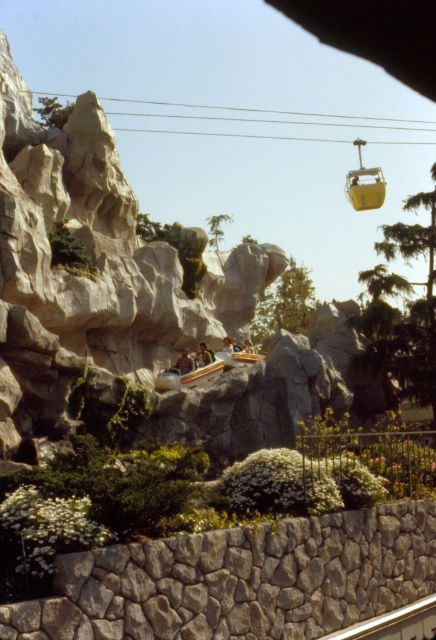
Looking at this image, between orange glossy roller coaster at center and yellow matte ski lift at upper right, which one is positioned higher?

yellow matte ski lift at upper right is above.

Can you confirm if orange glossy roller coaster at center is positioned above yellow matte ski lift at upper right?

No.

Where is `orange glossy roller coaster at center`? This screenshot has width=436, height=640. orange glossy roller coaster at center is located at coordinates (207, 365).

Is yellow matte ski lift at upper right wider than brown leather jacket at center?

Correct, the width of yellow matte ski lift at upper right exceeds that of brown leather jacket at center.

This screenshot has width=436, height=640. What do you see at coordinates (364, 182) in the screenshot?
I see `yellow matte ski lift at upper right` at bounding box center [364, 182].

This screenshot has width=436, height=640. What are the coordinates of `yellow matte ski lift at upper right` in the screenshot? It's located at (364, 182).

Can you confirm if gray rough stone wall at lower center is positioned to the left of brown leather jacket at center?

In fact, gray rough stone wall at lower center is to the right of brown leather jacket at center.

Does point (78, 618) come farther from viewer compared to point (197, 362)?

No, it is in front of (197, 362).

The height and width of the screenshot is (640, 436). I want to click on gray rough stone wall at lower center, so click(x=241, y=580).